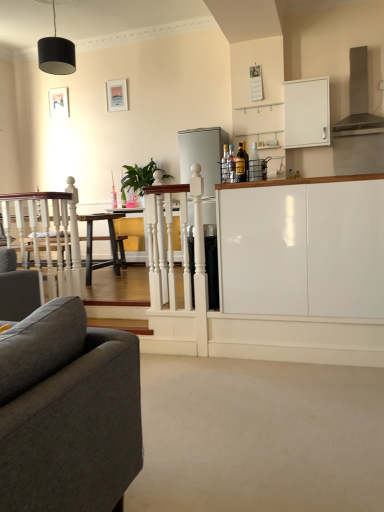
Question: Is white glossy cabinet at center, marked as the 1th cabinetry in a bottom-to-top arrangement, at the left side of white glossy cabinet at upper right, the 1th cabinetry when ordered from top to bottom?

Choices:
 (A) no
 (B) yes

Answer: (B)

Question: Does white glossy cabinet at center, which appears as the second cabinetry when viewed from the top, turn towards white glossy cabinet at upper right, which is counted as the second cabinetry, starting from the front?

Choices:
 (A) no
 (B) yes

Answer: (A)

Question: From the image's perspective, is white glossy cabinet at center, placed as the first cabinetry when sorted from front to back, beneath white glossy cabinet at upper right, marked as the first cabinetry in a back-to-front arrangement?

Choices:
 (A) no
 (B) yes

Answer: (B)

Question: From the image's perspective, is white glossy cabinet at center, marked as the 1th cabinetry in a bottom-to-top arrangement, located above white glossy cabinet at upper right, which is counted as the second cabinetry, starting from the front?

Choices:
 (A) yes
 (B) no

Answer: (B)

Question: From a real-world perspective, does white glossy cabinet at center, marked as the 1th cabinetry in a bottom-to-top arrangement, stand above white glossy cabinet at upper right, which is counted as the second cabinetry, starting from the front?

Choices:
 (A) no
 (B) yes

Answer: (A)

Question: Is white glossy cabinet at center, marked as the 1th cabinetry in a bottom-to-top arrangement, placed right next to white glossy cabinet at upper right, marked as the first cabinetry in a back-to-front arrangement?

Choices:
 (A) no
 (B) yes

Answer: (A)

Question: Is white glossy table at center a part of matte gray exhaust hood at upper right?

Choices:
 (A) no
 (B) yes

Answer: (A)

Question: Is matte gray exhaust hood at upper right smaller than white glossy table at center?

Choices:
 (A) yes
 (B) no

Answer: (B)

Question: Does matte gray exhaust hood at upper right lie behind white glossy table at center?

Choices:
 (A) yes
 (B) no

Answer: (B)

Question: Does matte gray exhaust hood at upper right appear on the left side of white glossy table at center?

Choices:
 (A) yes
 (B) no

Answer: (B)

Question: Does matte gray exhaust hood at upper right turn towards white glossy table at center?

Choices:
 (A) yes
 (B) no

Answer: (B)

Question: From the image's perspective, is matte gray exhaust hood at upper right above white glossy table at center?

Choices:
 (A) no
 (B) yes

Answer: (B)

Question: Are satin silver refrigerator at center and white glossy cabinet at upper right, which is counted as the second cabinetry, starting from the front, located far from each other?

Choices:
 (A) yes
 (B) no

Answer: (A)